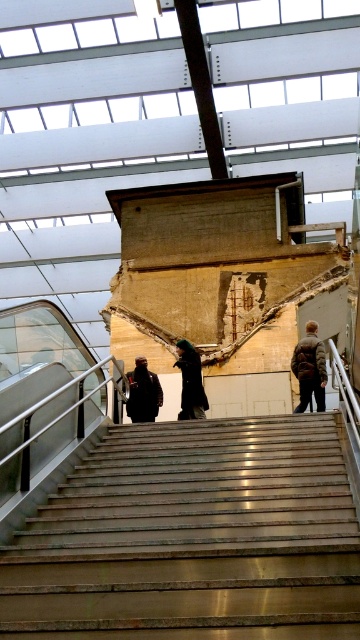
Is black matte coat at center bigger than dark gray jacket at center?

Yes, black matte coat at center is bigger than dark gray jacket at center.

Locate an element on the screen. black matte coat at center is located at coordinates (191, 381).

Is point (185, 358) positioned after point (141, 419)?

Yes, it is behind point (141, 419).

Image resolution: width=360 pixels, height=640 pixels. Find the location of `black matte coat at center`. black matte coat at center is located at coordinates (191, 381).

Can you confirm if polished marble stairs at center is wider than brown fuzzy coat at upper right?

Indeed, polished marble stairs at center has a greater width compared to brown fuzzy coat at upper right.

Who is shorter, polished marble stairs at center or brown fuzzy coat at upper right?

polished marble stairs at center

Which is behind, point (136, 529) or point (308, 388)?

The point (308, 388) is behind.

Identify the location of polished marble stairs at center. The width and height of the screenshot is (360, 640). (192, 538).

Who is lower down, polished marble stairs at center or black matte coat at center?

polished marble stairs at center

You are a GUI agent. You are given a task and a screenshot of the screen. Output one action in this format:
    pyautogui.click(x=<x>, y=<y>)
    Task: Click on the polished marble stairs at center
    
    Given the screenshot: What is the action you would take?
    pyautogui.click(x=192, y=538)

The height and width of the screenshot is (640, 360). What are the coordinates of `polished marble stairs at center` in the screenshot? It's located at (192, 538).